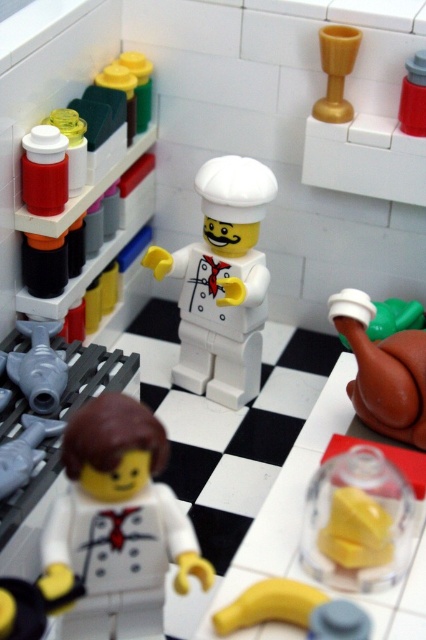
Question: Which of the following is the closest to the observer?

Choices:
 (A) gold plastic cup at upper center
 (B) yellow rubber glove at lower left

Answer: (B)

Question: Which of these objects is positioned farthest from the transparent plastic jar at center?

Choices:
 (A) yellow rubber banana at lower center
 (B) brown matte turkey at right

Answer: (B)

Question: Is gold plastic cup at upper center closer to camera compared to smooth plastic bottle at upper right?

Choices:
 (A) no
 (B) yes

Answer: (A)

Question: Among these points, which one is nearest to the camera?

Choices:
 (A) (146, 410)
 (B) (345, 600)
 (C) (13, 595)
 (D) (190, 278)

Answer: (C)

Question: Does gray matte pipe at lower left have a greater width compared to gold plastic cup at upper center?

Choices:
 (A) yes
 (B) no

Answer: (A)

Question: From the image, what is the correct spatial relationship of smooth white chef at center in relation to brown matte turkey at right?

Choices:
 (A) below
 (B) above

Answer: (A)